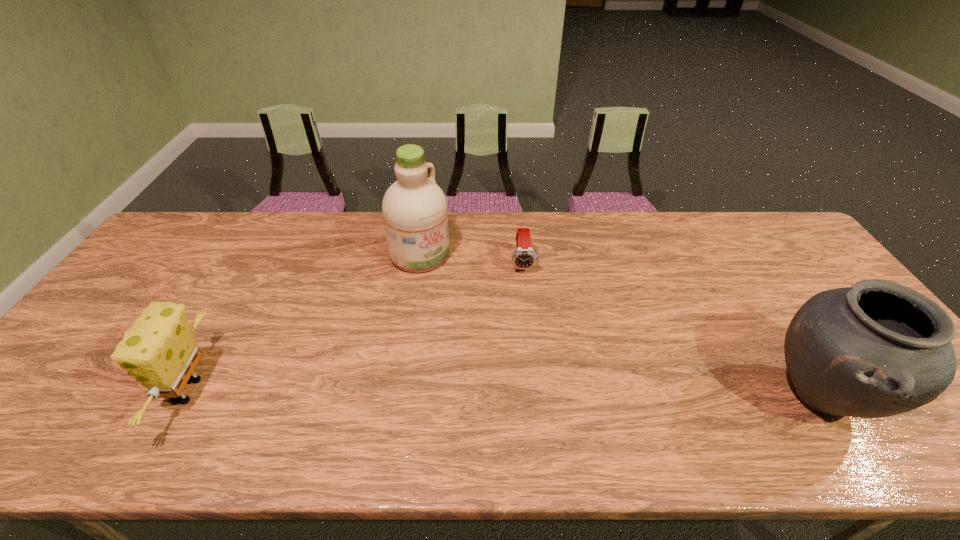
Locate an element on the screen. This screenshot has width=960, height=540. object that stands as the third closest to the sponge is located at coordinates (876, 349).